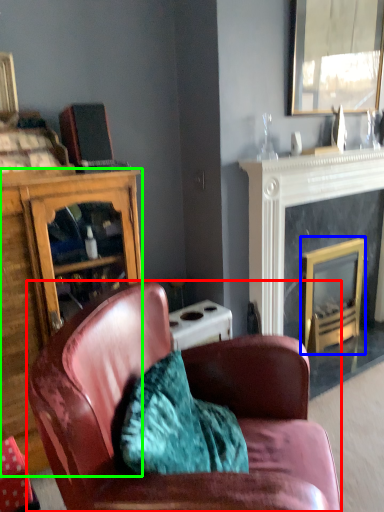
Question: Which object is positioned closest to chair (highlighted by a red box)? Select from fireplace (highlighted by a blue box) and cabinetry (highlighted by a green box).

Choices:
 (A) fireplace
 (B) cabinetry

Answer: (B)